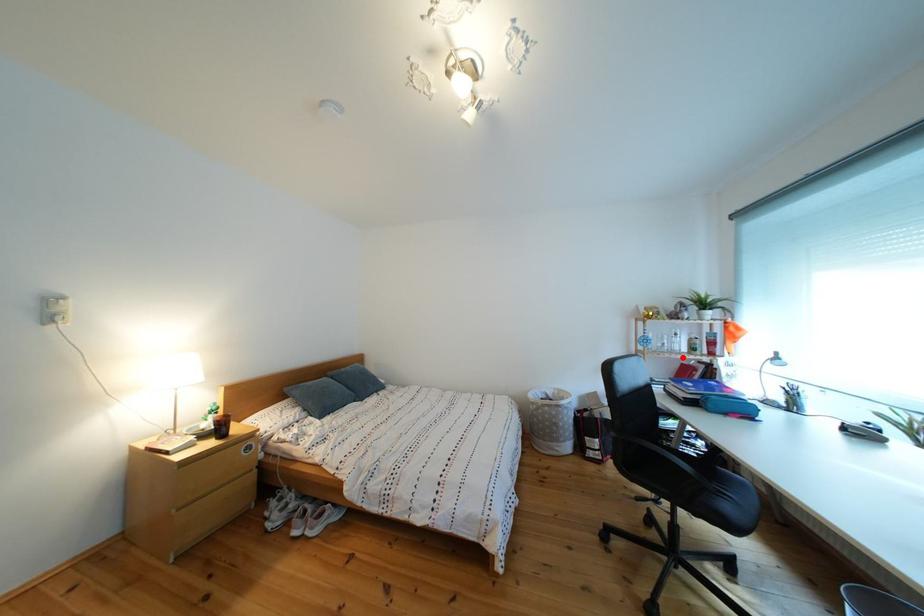
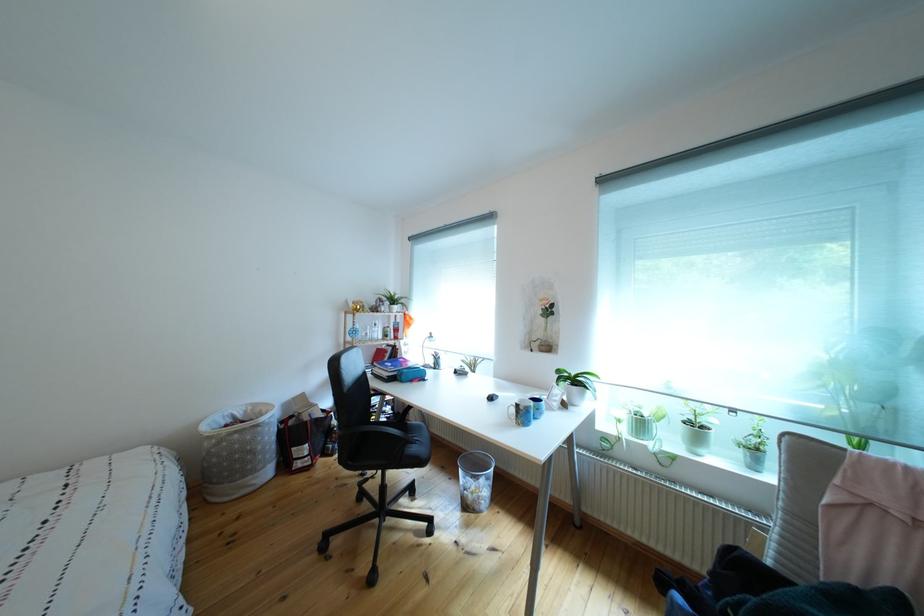
Where in the second image is the point corresponding to the highlighted location from the first image?

(383, 345)